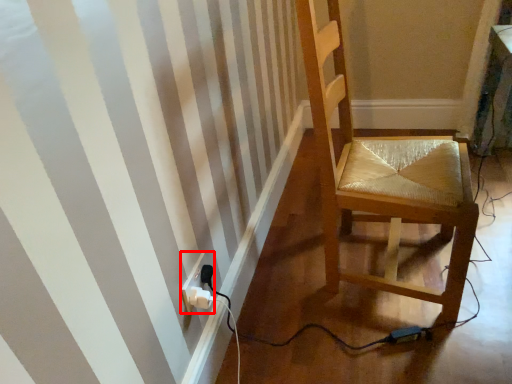
Question: Considering the relative positions of electric outlet (annotated by the red box) and chair in the image provided, where is electric outlet (annotated by the red box) located with respect to the staircase?

Choices:
 (A) right
 (B) left

Answer: (B)